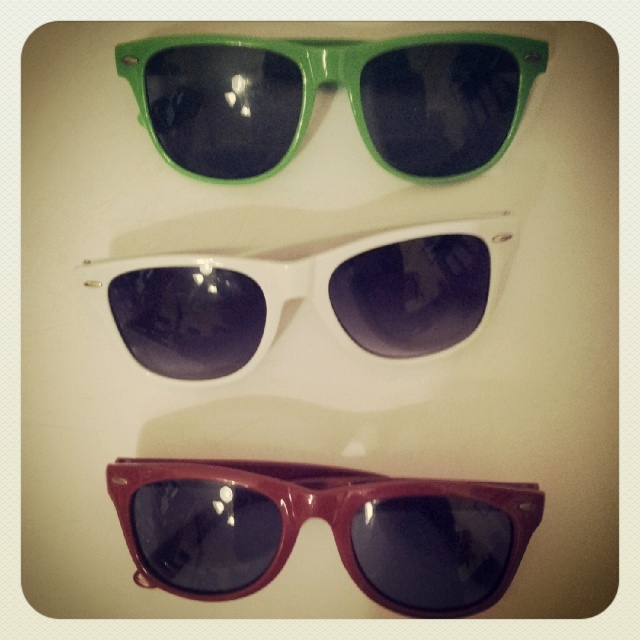
You are a customer in a sunglasses store. You see the glossy burgundy sunglasses at bottom and the green glossy sunglasses at upper center. Which pair is positioned lower in the arrangement?

The glossy burgundy sunglasses at bottom is located below the green glossy sunglasses at upper center, so it is positioned lower in the arrangement.

You are organizing sunglasses on a display rack. You have the green glossy sunglasses at upper center and the white glossy sunglasses at center. Which one is placed above the other?

The green glossy sunglasses at upper center is positioned over the white glossy sunglasses at center.

You are a customer at an eyewear store and want to choose between the glossy burgundy sunglasses at bottom and the white glossy sunglasses at center. The store has a policy that only allows you to try on one pair at a time. If you first try on the pair that is smaller in size, which pair will you put on first?

The white glossy sunglasses at center is smaller in size than the glossy burgundy sunglasses at bottom. Therefore, you will first try on the white glossy sunglasses at center.